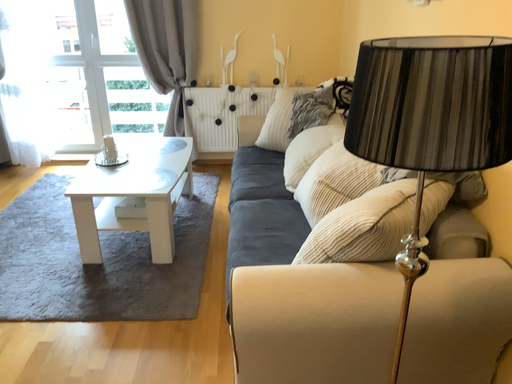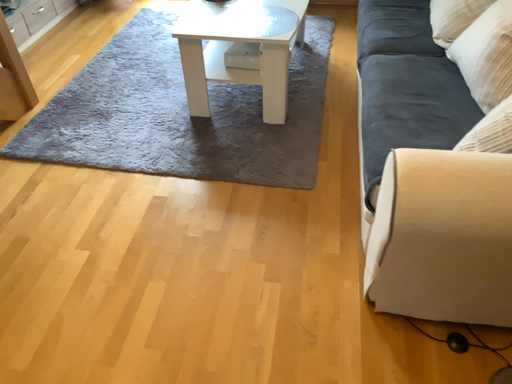
Question: How did the camera likely rotate when shooting the video?

Choices:
 (A) rotated right
 (B) rotated left

Answer: (B)